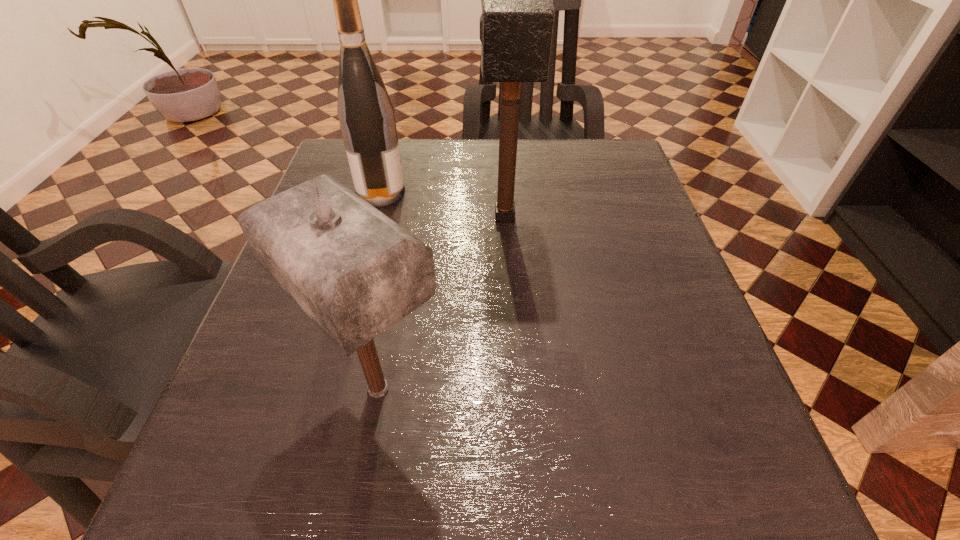
Identify the location of vacant space that satisfies the following two spatial constraints: 1. on the front side of the wine bottle; 2. on the left side of the right mallet. (374, 217).